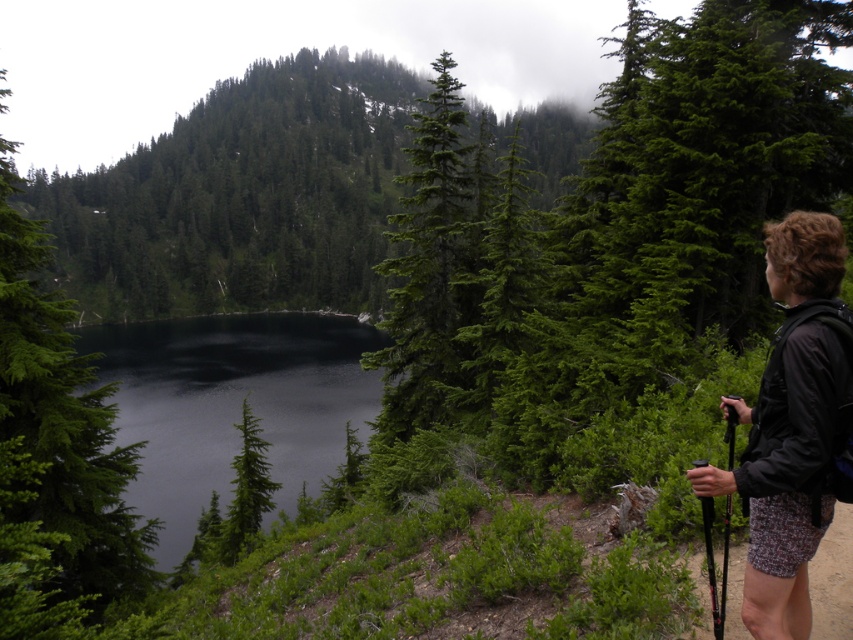
You are standing at the center of the image and want to walk towards the green matte tree at left. In which direction should you move?

The green matte tree at left is located at point 0.722 on the x axis and 0.069 on the y axis. Since you are at the center, you should move towards the left and slightly downward to reach it.

You are a photographer planning to capture the green evergreen tree at upper center and the dark reflective water at center in a single shot. Considering their sizes, which object should you focus on first to ensure both are in frame?

The green evergreen tree at upper center is bigger than the dark reflective water at center, so you should focus on the green evergreen tree at upper center first to ensure both fit in the frame.

You are a photographer planning to capture a landscape shot of the green matte tree at left and dark reflective water at center. Based on their positions, which object would you focus on first to ensure both are in frame?

The green matte tree at left is positioned over dark reflective water at center, so focusing on the tree first would ensure the water remains in frame as it is beneath the tree.